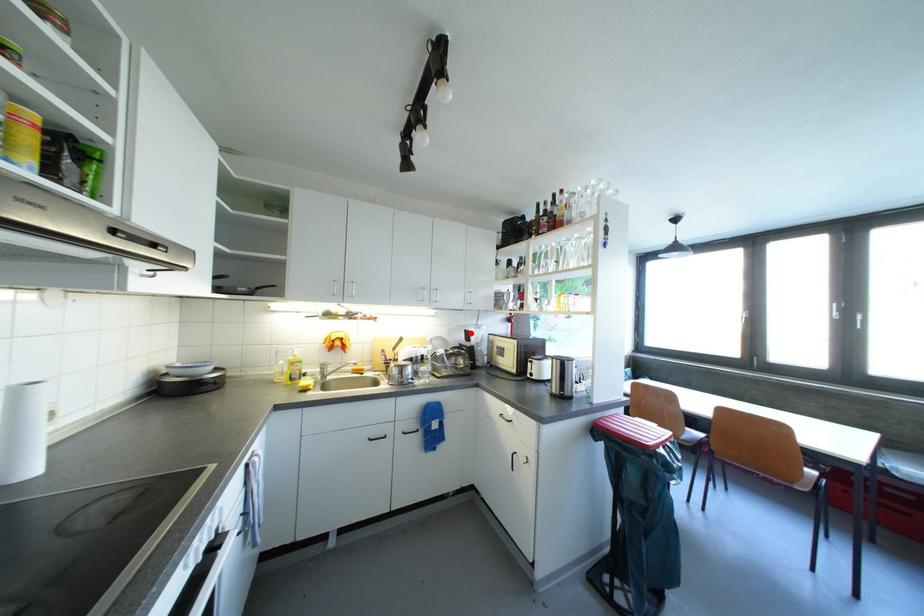
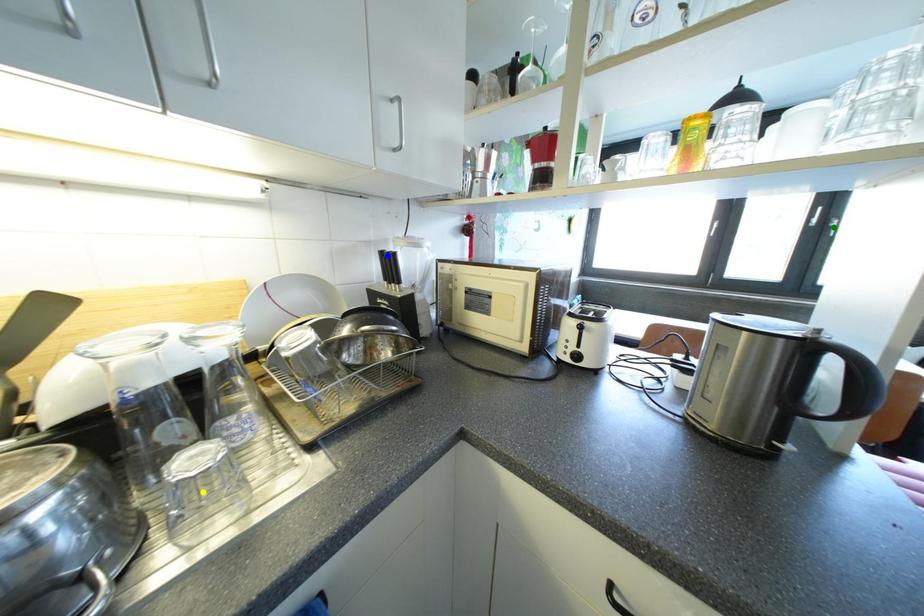
Question: I am providing you with two images of the same scene from different viewpoints. A red point is marked on the first image. You are given multiple points on the second image. In image 2, which mark is for the same physical point as the one in image 1?

Choices:
 (A) yellow point
 (B) green point
 (C) blue point

Answer: (C)